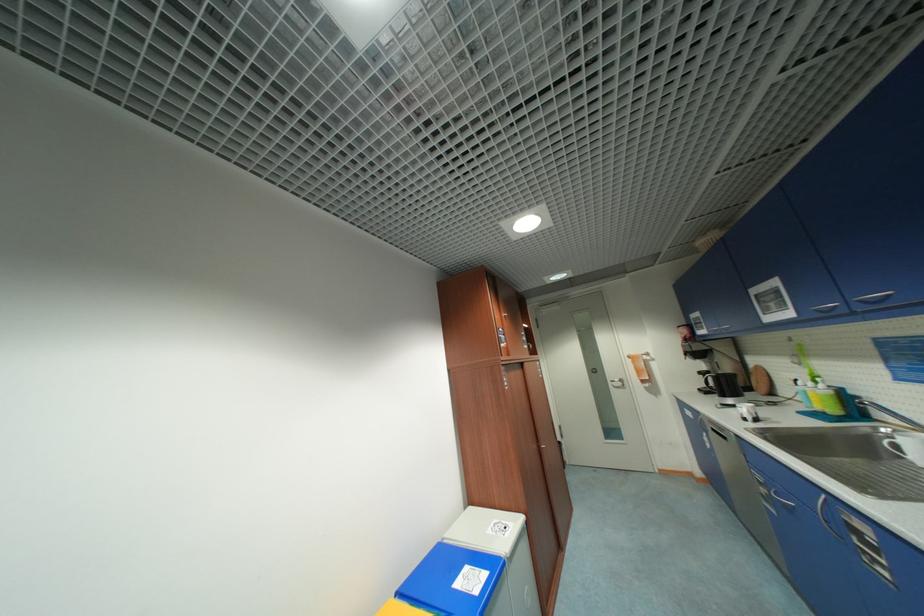
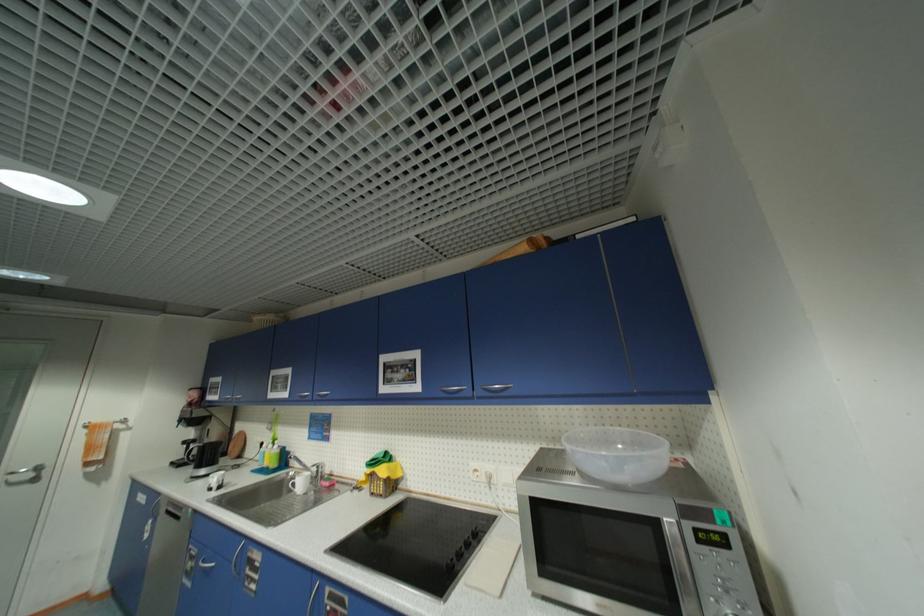
The point at (867, 302) is marked in the first image. Where is the corresponding point in the second image?

(323, 395)